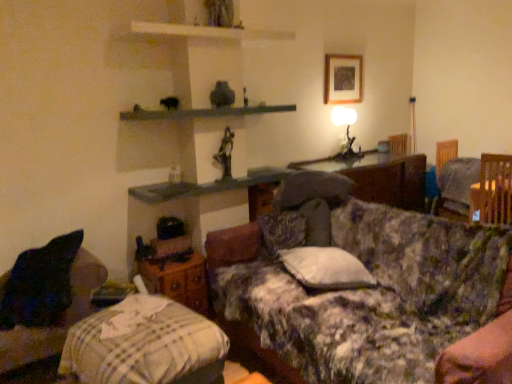
Question: From a real-world perspective, does floral fabric couch at center stand above velvet dark blue pillow at lower left?

Choices:
 (A) no
 (B) yes

Answer: (B)

Question: Is floral fabric couch at center outside of velvet dark blue pillow at lower left?

Choices:
 (A) yes
 (B) no

Answer: (A)

Question: Is the position of floral fabric couch at center more distant than that of velvet dark blue pillow at lower left?

Choices:
 (A) no
 (B) yes

Answer: (A)

Question: Can you confirm if floral fabric couch at center is thinner than velvet dark blue pillow at lower left?

Choices:
 (A) no
 (B) yes

Answer: (A)

Question: Is floral fabric couch at center shorter than velvet dark blue pillow at lower left?

Choices:
 (A) no
 (B) yes

Answer: (A)

Question: Looking at the image, does wooden swivel chair at right seem bigger or smaller compared to velvet dark blue pillow at lower left?

Choices:
 (A) big
 (B) small

Answer: (B)

Question: Is point coord(505,155) positioned closer to the camera than point coord(86,266)?

Choices:
 (A) closer
 (B) farther

Answer: (B)

Question: In terms of width, does wooden swivel chair at right look wider or thinner when compared to velvet dark blue pillow at lower left?

Choices:
 (A) thin
 (B) wide

Answer: (A)

Question: Based on their positions, is wooden swivel chair at right located to the left or right of velvet dark blue pillow at lower left?

Choices:
 (A) left
 (B) right

Answer: (B)

Question: In the image, is smooth gray stone mantle at upper center on the left side or the right side of wooden at left?

Choices:
 (A) right
 (B) left

Answer: (A)

Question: Considering the positions of point (144, 117) and point (190, 256), is point (144, 117) closer or farther from the camera than point (190, 256)?

Choices:
 (A) closer
 (B) farther

Answer: (A)

Question: From a real-world perspective, is smooth gray stone mantle at upper center physically located above or below wooden at left?

Choices:
 (A) above
 (B) below

Answer: (A)

Question: In terms of width, does smooth gray stone mantle at upper center look wider or thinner when compared to wooden at left?

Choices:
 (A) thin
 (B) wide

Answer: (B)

Question: Would you say wooden swivel chair at right is to the left or to the right of metallic statue at upper center in the picture?

Choices:
 (A) right
 (B) left

Answer: (A)

Question: Considering the positions of wooden swivel chair at right and metallic statue at upper center in the image, is wooden swivel chair at right taller or shorter than metallic statue at upper center?

Choices:
 (A) tall
 (B) short

Answer: (B)